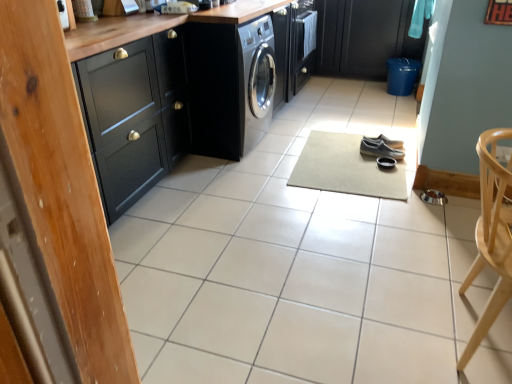
Identify the location of vacant region to the right of satin black washing machine at center. The height and width of the screenshot is (384, 512). (295, 132).